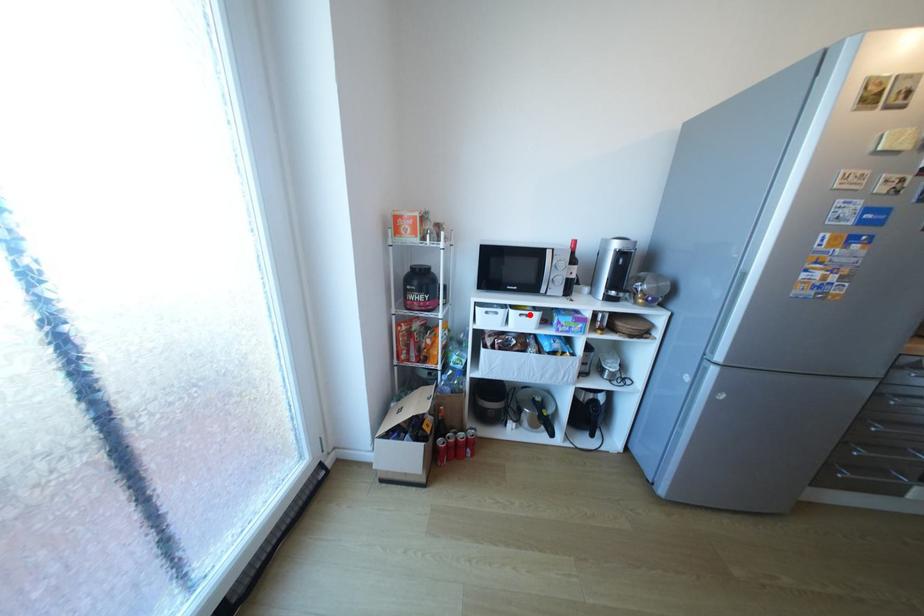
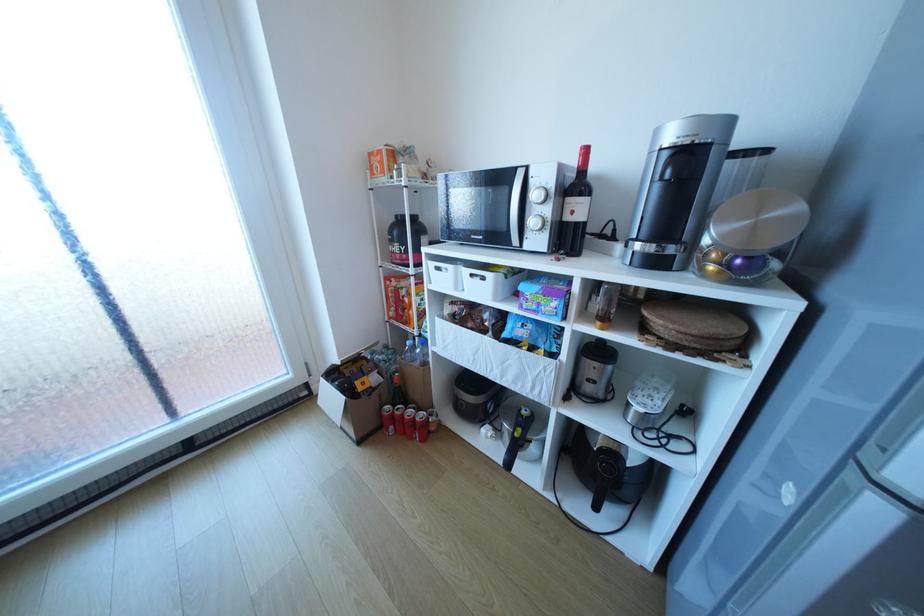
The point at the highlighted location is marked in the first image. Where is the corresponding point in the second image?

(481, 275)